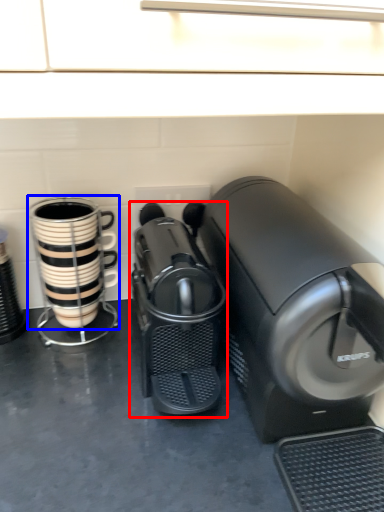
Question: Which of the following is the closest to the observer, home appliance (highlighted by a red box) or coffee cup (highlighted by a blue box)?

Choices:
 (A) home appliance
 (B) coffee cup

Answer: (A)